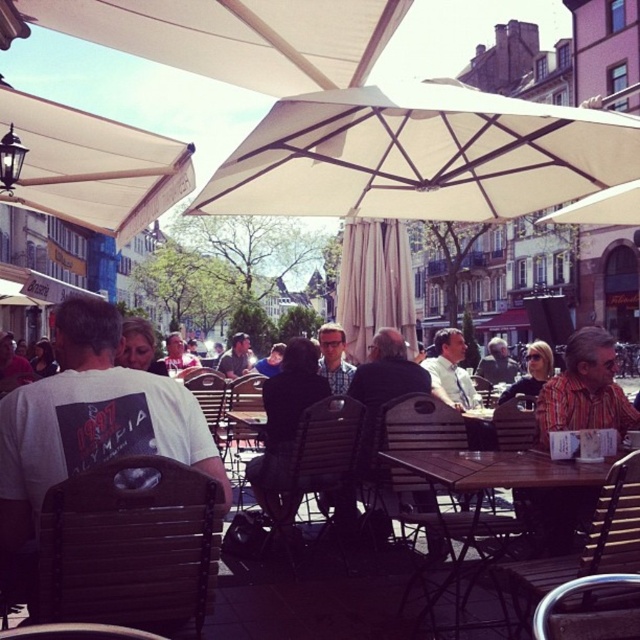
Question: Which point is closer to the camera?

Choices:
 (A) matte black sunglasses at center
 (B) wooden table at center

Answer: (B)

Question: Which of the following is the closest to the observer?

Choices:
 (A) matte gray jacket at center
 (B) matte black jacket at center
 (C) beige fabric umbrella at center
 (D) white fabric umbrella at upper center

Answer: (C)

Question: From the image, what is the correct spatial relationship of beige fabric umbrella at upper left in relation to matte gray jacket at center?

Choices:
 (A) below
 (B) above

Answer: (B)

Question: Can you confirm if white fabric umbrella at upper center is positioned to the left of matte black sunglasses at center?

Choices:
 (A) yes
 (B) no

Answer: (A)

Question: Which of the following is the farthest from the observer?

Choices:
 (A) matte black sunglasses at center
 (B) beige fabric umbrella at upper left
 (C) matte gray jacket at center

Answer: (C)

Question: Observing the image, what is the correct spatial positioning of wooden table at center in reference to matte black sunglasses at center?

Choices:
 (A) left
 (B) right

Answer: (A)